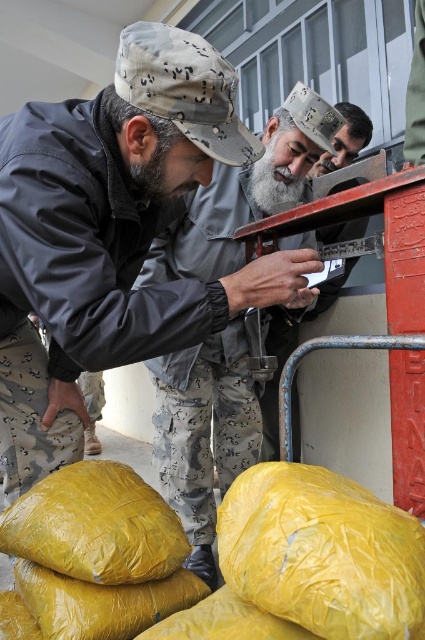
You are a delivery person who needs to move the yellow plastic sack at lower left and the graywoollybeard at center to the loading dock. Based on their positions in the image, which object should you move first to avoid blocking the path to the other?

The yellow plastic sack at lower left is located below graywoollybeard at center, so you should move the graywoollybeard at center first to avoid blocking the path to the yellow plastic sack at lower left.

Looking at this image, in the scene described, there are a yellow plastic sack at lower left and a graywoollybeard at center. From the perspective of someone standing at the front of the image, which object is positioned to the left?

The yellow plastic sack at lower left is positioned to the left of graywoollybeard at center.

You are a photographer standing in front of the scene. You need to take a photo that includes both the bearded man at center and the graywoollybeard at center. Considering their heights, which one should you position closer to the camera to ensure both are fully visible in the frame?

The bearded man at center is taller than the graywoollybeard at center. To ensure both are fully visible, position the shorter graywoollybeard at center closer to the camera so that the taller bearded man at center can be captured without being cropped at the top.